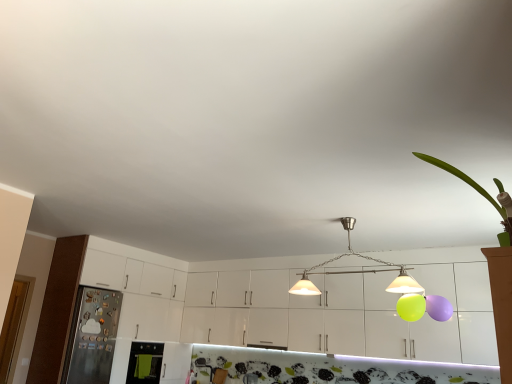
Question: Is metallic pendant lights at center smaller than green leafy plant at upper right?

Choices:
 (A) yes
 (B) no

Answer: (B)

Question: Does metallic pendant lights at center have a lesser width compared to green leafy plant at upper right?

Choices:
 (A) no
 (B) yes

Answer: (A)

Question: Is metallic pendant lights at center in front of green leafy plant at upper right?

Choices:
 (A) no
 (B) yes

Answer: (A)

Question: Can you confirm if metallic pendant lights at center is taller than green leafy plant at upper right?

Choices:
 (A) no
 (B) yes

Answer: (B)

Question: From a real-world perspective, is metallic pendant lights at center located beneath green leafy plant at upper right?

Choices:
 (A) no
 (B) yes

Answer: (A)

Question: Is point (131, 372) closer or farther from the camera than point (414, 291)?

Choices:
 (A) farther
 (B) closer

Answer: (A)

Question: Based on their sizes in the image, would you say green fabric oven at lower left, the 1th appliance positioned from the right, is bigger or smaller than metallic pendant lights at center?

Choices:
 (A) small
 (B) big

Answer: (A)

Question: Considering the positions of green fabric oven at lower left, the 2th appliance from the left, and metallic pendant lights at center in the image, is green fabric oven at lower left, the 2th appliance from the left, taller or shorter than metallic pendant lights at center?

Choices:
 (A) short
 (B) tall

Answer: (A)

Question: In the image, is green fabric oven at lower left, the 1th appliance positioned from the right, positioned in front of or behind metallic pendant lights at center?

Choices:
 (A) front
 (B) behind

Answer: (B)

Question: Is metallic refrigerator at left, the 2th appliance viewed from the right, taller or shorter than white glossy cabinets at center?

Choices:
 (A) tall
 (B) short

Answer: (B)

Question: Is point (101, 344) closer or farther from the camera than point (476, 349)?

Choices:
 (A) closer
 (B) farther

Answer: (B)

Question: Considering their positions, is metallic refrigerator at left, the 2th appliance viewed from the right, located in front of or behind white glossy cabinets at center?

Choices:
 (A) behind
 (B) front

Answer: (A)

Question: Considering the positions of metallic refrigerator at left, acting as the first appliance starting from the left, and white glossy cabinets at center in the image, is metallic refrigerator at left, acting as the first appliance starting from the left, wider or thinner than white glossy cabinets at center?

Choices:
 (A) thin
 (B) wide

Answer: (B)

Question: Does point (494, 205) appear closer or farther from the camera than point (138, 350)?

Choices:
 (A) farther
 (B) closer

Answer: (B)

Question: Looking at their shapes, would you say green leafy plant at upper right is wider or thinner than green fabric oven at lower left, the 2th appliance from the left?

Choices:
 (A) wide
 (B) thin

Answer: (A)